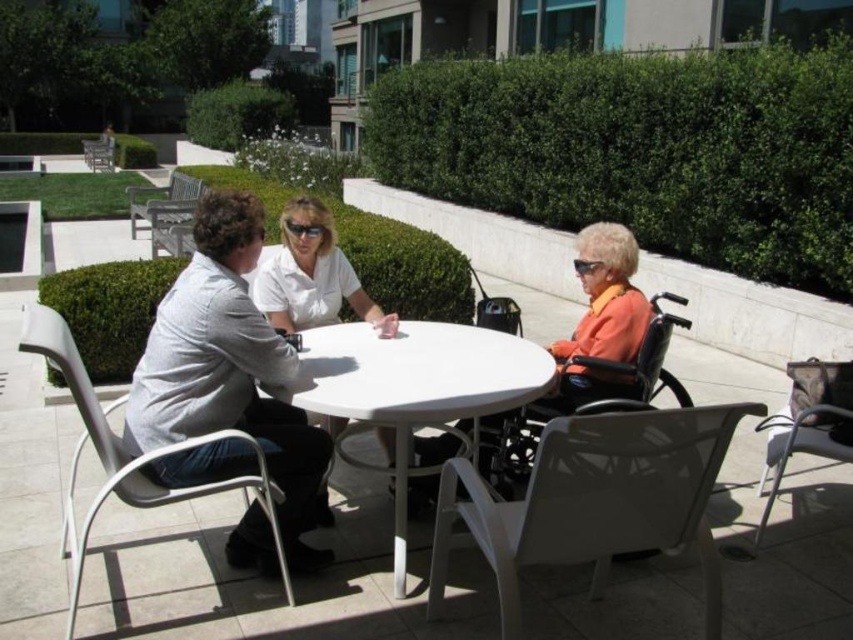
Question: Observing the image, what is the correct spatial positioning of green leafy hedge at upper right in reference to wooden bench at upper left?

Choices:
 (A) right
 (B) left

Answer: (A)

Question: Which point is farther to the camera?

Choices:
 (A) (612, 298)
 (B) (498, 536)
 (C) (848, 234)
 (D) (399, 448)

Answer: (C)

Question: Is white plastic chair at left in front of metallic silver chair at upper left?

Choices:
 (A) yes
 (B) no

Answer: (A)

Question: Among these points, which one is farthest from the camera?

Choices:
 (A) (625, 404)
 (B) (91, 506)
 (C) (407, 394)
 (D) (236, 93)

Answer: (D)

Question: Which object is the farthest from the white plastic chair at lower right?

Choices:
 (A) matte black wheelchair at lower right
 (B) metallic silver chair at upper left
 (C) green leafy hedge at upper center

Answer: (B)

Question: Is white plastic table at center thinner than wooden bench at upper left?

Choices:
 (A) no
 (B) yes

Answer: (B)